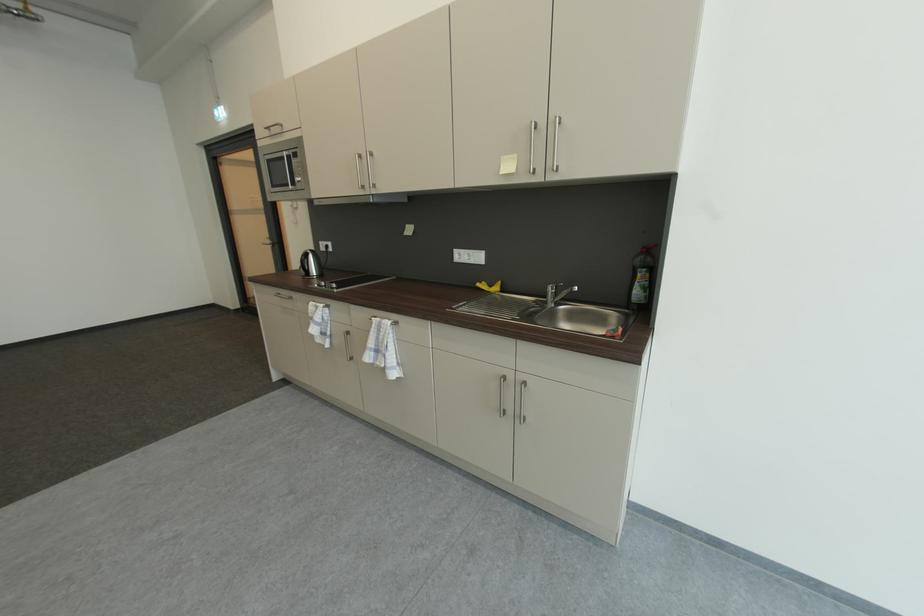
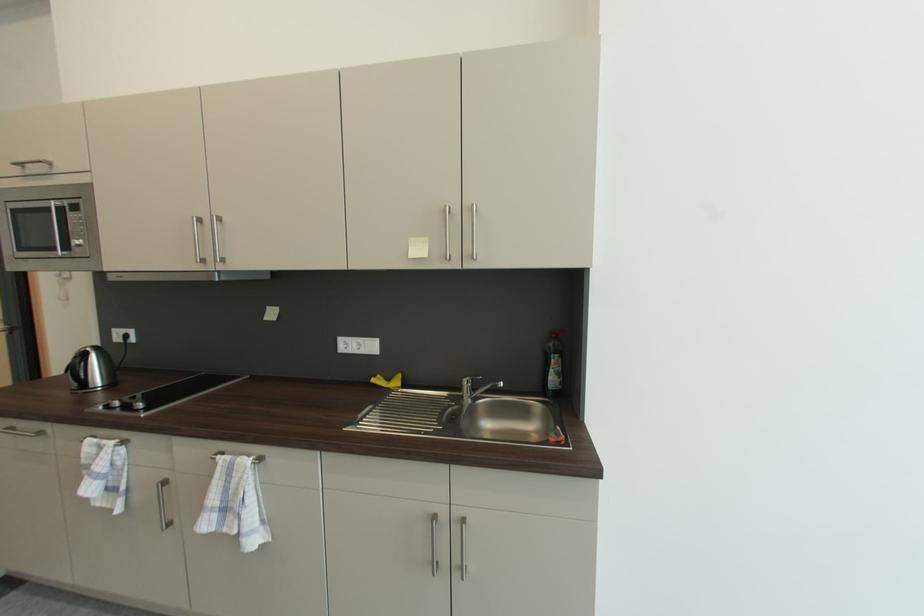
Which direction would the cameraman need to move to produce the second image?

The movement direction of the cameraman is left, forward.